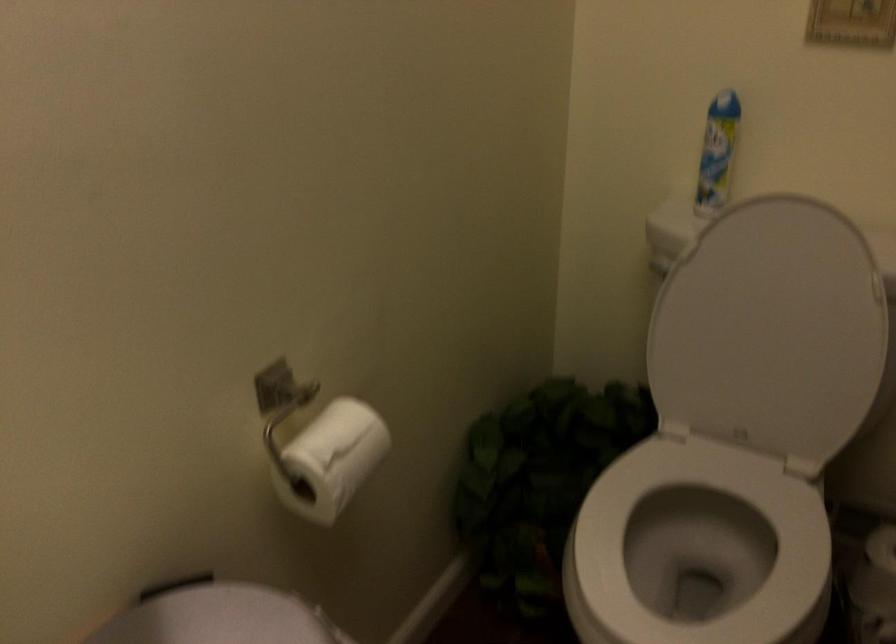
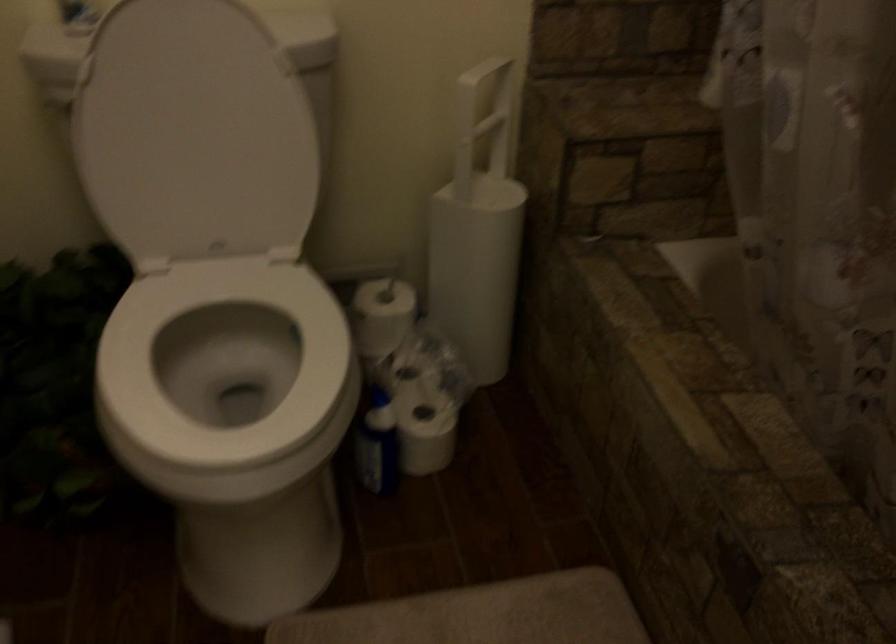
In the second image, find the point that corresponds to (747,327) in the first image.

(194, 134)